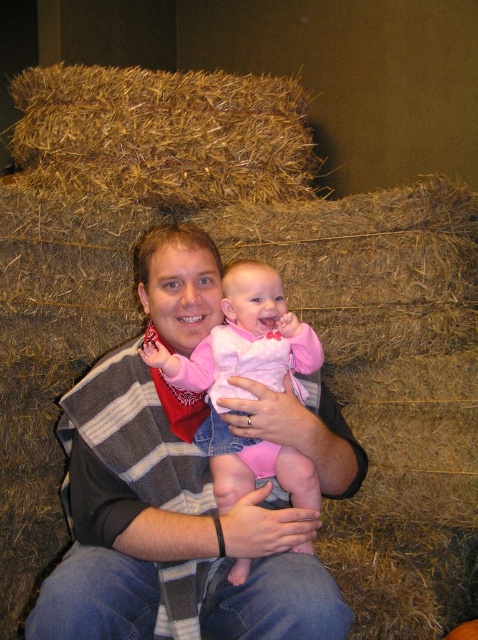
Question: Among these objects, which one is farthest from the camera?

Choices:
 (A) striped wool sweater at center
 (B) pink fleece baby at center

Answer: (B)

Question: Which object is the closest to the brown straw bale at upper left?

Choices:
 (A) pink fleece baby at center
 (B) striped wool sweater at center

Answer: (A)

Question: Is the position of striped wool sweater at center more distant than that of brown straw bale at upper left?

Choices:
 (A) yes
 (B) no

Answer: (B)

Question: Which object is positioned farthest from the pink fleece baby at center?

Choices:
 (A) brown straw bale at upper left
 (B) striped wool sweater at center

Answer: (A)

Question: Considering the relative positions of striped wool sweater at center and pink fleece baby at center in the image provided, where is striped wool sweater at center located with respect to pink fleece baby at center?

Choices:
 (A) below
 (B) above

Answer: (A)

Question: Can you confirm if brown straw bale at upper left is positioned to the right of pink fleece baby at center?

Choices:
 (A) no
 (B) yes

Answer: (A)